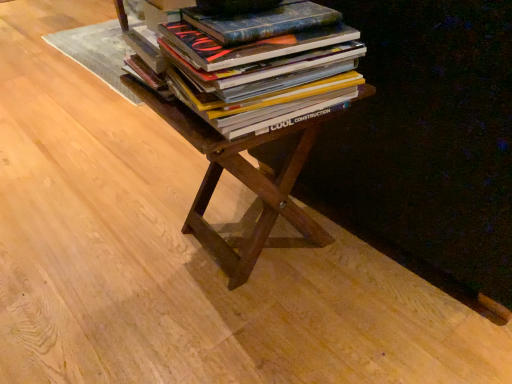
Image resolution: width=512 pixels, height=384 pixels. Find the location of `brown wood table at center`. brown wood table at center is located at coordinates (243, 183).

This screenshot has height=384, width=512. What do you see at coordinates (243, 183) in the screenshot?
I see `brown wood table at center` at bounding box center [243, 183].

What is the approximate height of hardcover books at center?

It is 21.73 centimeters.

Describe the element at coordinates (256, 64) in the screenshot. I see `hardcover books at center` at that location.

You are a GUI agent. You are given a task and a screenshot of the screen. Output one action in this format:
    pyautogui.click(x=<x>, y=<y>)
    Task: Click on the hardcover books at center
    
    Given the screenshot: What is the action you would take?
    pyautogui.click(x=256, y=64)

Find the location of `brown wood table at center`. brown wood table at center is located at coordinates (243, 183).

Consider the image. Is brown wood table at center to the right of hardcover books at center from the viewer's perspective?

Incorrect, brown wood table at center is not on the right side of hardcover books at center.

In the image, is brown wood table at center positioned in front of or behind hardcover books at center?

Visually, brown wood table at center is located behind hardcover books at center.

Is point (248, 273) closer to viewer compared to point (172, 35)?

No, (248, 273) is further to viewer.

From the image's perspective, is brown wood table at center located above or below hardcover books at center?

Based on their image positions, brown wood table at center is located beneath hardcover books at center.

From a real-world perspective, who is located higher, brown wood table at center or hardcover books at center?

hardcover books at center.

Is brown wood table at center wider than hardcover books at center?

Yes.

Can you confirm if brown wood table at center is taller than hardcover books at center?

Correct, brown wood table at center is much taller as hardcover books at center.

Is brown wood table at center smaller than hardcover books at center?

No, brown wood table at center is not smaller than hardcover books at center.

Is brown wood table at center positioned beyond the bounds of hardcover books at center?

brown wood table at center lies outside hardcover books at center's area.

Is brown wood table at center in contact with hardcover books at center?

No.

Is hardcover books at center at the back of brown wood table at center?

brown wood table at center does not have its back to hardcover books at center.

What's the angular difference between brown wood table at center and hardcover books at center's facing directions?

The angular difference between brown wood table at center and hardcover books at center is 85.7 degrees.

The width and height of the screenshot is (512, 384). I want to click on table behind the hardcover books at center, so click(x=243, y=183).

Considering the relative positions of hardcover books at center and brown wood table at center in the image provided, is hardcover books at center to the left of brown wood table at center from the viewer's perspective?

Incorrect, hardcover books at center is not on the left side of brown wood table at center.

Does hardcover books at center come behind brown wood table at center?

No, hardcover books at center is closer to the viewer.

Consider the image. Which is closer to the camera, (359, 74) or (279, 213)?

Clearly, point (359, 74) is closer to the camera than point (279, 213).

From the image's perspective, would you say hardcover books at center is shown under brown wood table at center?

Actually, hardcover books at center appears above brown wood table at center in the image.

From a real-world perspective, relative to brown wood table at center, is hardcover books at center vertically above or below?

hardcover books at center is above brown wood table at center.

From the picture: Is hardcover books at center thinner than brown wood table at center?

Yes, hardcover books at center is thinner than brown wood table at center.

Which of these two, hardcover books at center or brown wood table at center, stands shorter?

With less height is hardcover books at center.

Does hardcover books at center have a larger size compared to brown wood table at center?

Incorrect, hardcover books at center is not larger than brown wood table at center.

Is brown wood table at center a part of hardcover books at center?

Actually, brown wood table at center is outside hardcover books at center.

Is hardcover books at center next to brown wood table at center and touching it?

hardcover books at center and brown wood table at center are not in contact.

Is brown wood table at center at the back of hardcover books at center?

No, hardcover books at center's orientation is not away from brown wood table at center.

Can you tell me how much hardcover books at center and brown wood table at center differ in facing direction?

The facing directions of hardcover books at center and brown wood table at center are 85.7 degrees apart.

Measure the distance from hardcover books at center to brown wood table at center.

hardcover books at center is 6.98 inches away from brown wood table at center.

The width and height of the screenshot is (512, 384). I want to click on table below the hardcover books at center (from a real-world perspective), so click(x=243, y=183).

Find the location of a particular element. The image size is (512, 384). book above the brown wood table at center (from a real-world perspective) is located at coordinates (256, 64).

Where is `table behind the hardcover books at center`? table behind the hardcover books at center is located at coordinates (243, 183).